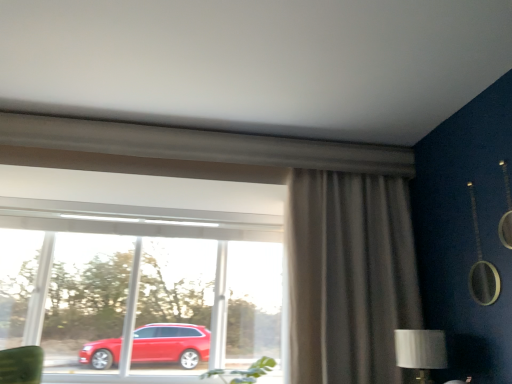
The height and width of the screenshot is (384, 512). Describe the element at coordinates (420, 349) in the screenshot. I see `silver metallic table lamp at lower right` at that location.

The height and width of the screenshot is (384, 512). I want to click on transparent glass window at center, so click(x=139, y=293).

What are the coordinates of `silver metallic table lamp at lower right` in the screenshot? It's located at 420,349.

Is matte gray curtain at right oriented away from transparent glass window at center?

That's not correct — matte gray curtain at right is not looking away from transparent glass window at center.

From the image's perspective, which is below, matte gray curtain at right or transparent glass window at center?

transparent glass window at center, from the image's perspective.

Who is shorter, matte gray curtain at right or transparent glass window at center?

transparent glass window at center.

Is transparent glass window at center a part of matte gray curtain at right?

No, transparent glass window at center is not inside matte gray curtain at right.

From the image's perspective, who appears lower, transparent glass window at center or silver metallic table lamp at lower right?

silver metallic table lamp at lower right, from the image's perspective.

Is transparent glass window at center aimed at silver metallic table lamp at lower right?

Yes, transparent glass window at center is aimed at silver metallic table lamp at lower right.

Is transparent glass window at center closer to the viewer compared to silver metallic table lamp at lower right?

No, the depth of transparent glass window at center is greater than that of silver metallic table lamp at lower right.

Is transparent glass window at center far from silver metallic table lamp at lower right?

Yes.

Is matte gray curtain at right shorter than silver metallic table lamp at lower right?

In fact, matte gray curtain at right may be taller than silver metallic table lamp at lower right.

Does matte gray curtain at right come behind silver metallic table lamp at lower right?

Yes, matte gray curtain at right is behind silver metallic table lamp at lower right.

From a real-world perspective, is matte gray curtain at right under silver metallic table lamp at lower right?

No, from a real-world perspective, matte gray curtain at right is not below silver metallic table lamp at lower right.

Identify the location of table lamp lying in front of the matte gray curtain at right. Image resolution: width=512 pixels, height=384 pixels. (420, 349).

Is transparent glass window at center to the left or to the right of matte gray curtain at right in the image?

transparent glass window at center is to the left of matte gray curtain at right.

In the scene shown: Can you confirm if transparent glass window at center is shorter than matte gray curtain at right?

Indeed, transparent glass window at center has a lesser height compared to matte gray curtain at right.

Who is smaller, transparent glass window at center or matte gray curtain at right?

With smaller size is matte gray curtain at right.

Are transparent glass window at center and matte gray curtain at right located far from each other?

Yes.

Which of these two, silver metallic table lamp at lower right or transparent glass window at center, is bigger?

transparent glass window at center is bigger.

From a real-world perspective, between silver metallic table lamp at lower right and transparent glass window at center, who is vertically lower?

silver metallic table lamp at lower right.

Which object is closer to the camera taking this photo, silver metallic table lamp at lower right or transparent glass window at center?

Positioned in front is silver metallic table lamp at lower right.

From the image's perspective, which is above, silver metallic table lamp at lower right or matte gray curtain at right?

matte gray curtain at right is shown above in the image.

Is silver metallic table lamp at lower right taller or shorter than matte gray curtain at right?

Clearly, silver metallic table lamp at lower right is shorter compared to matte gray curtain at right.

Considering the relative positions of silver metallic table lamp at lower right and matte gray curtain at right in the image provided, is silver metallic table lamp at lower right to the left of matte gray curtain at right from the viewer's perspective?

Incorrect, silver metallic table lamp at lower right is not on the left side of matte gray curtain at right.

Considering the points (421, 333) and (367, 329), which point is behind, point (421, 333) or point (367, 329)?

The point (367, 329) is more distant.

Find the location of a particular element. curtain on the right of transparent glass window at center is located at coordinates (349, 276).

The image size is (512, 384). In order to click on table lamp located in front of the transparent glass window at center in this screenshot , I will do `click(420, 349)`.

In the scene shown: From the image, which object appears to be nearer to matte gray curtain at right, silver metallic table lamp at lower right or transparent glass window at center?

Among the two, silver metallic table lamp at lower right is located nearer to matte gray curtain at right.

Considering their positions, is matte gray curtain at right positioned further to silver metallic table lamp at lower right than transparent glass window at center?

Among the two, transparent glass window at center is located further to silver metallic table lamp at lower right.

Considering their positions, is transparent glass window at center positioned closer to matte gray curtain at right than silver metallic table lamp at lower right?

silver metallic table lamp at lower right lies closer to matte gray curtain at right than the other object.

When comparing their distances from transparent glass window at center, does silver metallic table lamp at lower right or matte gray curtain at right seem closer?

The object closer to transparent glass window at center is matte gray curtain at right.

Looking at the image, which one is located closer to transparent glass window at center, matte gray curtain at right or silver metallic table lamp at lower right?

matte gray curtain at right lies closer to transparent glass window at center than the other object.

Looking at the image, which one is located further to silver metallic table lamp at lower right, transparent glass window at center or matte gray curtain at right?

The object further to silver metallic table lamp at lower right is transparent glass window at center.

Where is `curtain located between transparent glass window at center and silver metallic table lamp at lower right in the left-right direction`? curtain located between transparent glass window at center and silver metallic table lamp at lower right in the left-right direction is located at coordinates (349, 276).